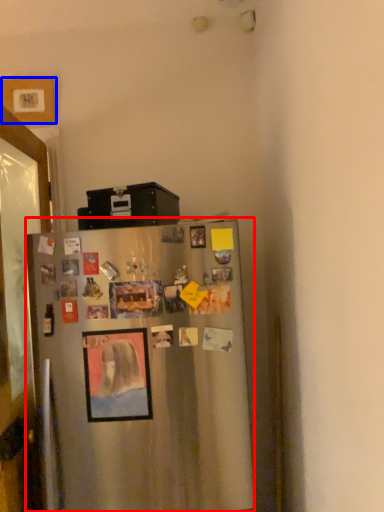
Question: Which of the following is the closest to the observer, refrigerator (highlighted by a red box) or picture frame (highlighted by a blue box)?

Choices:
 (A) refrigerator
 (B) picture frame

Answer: (A)